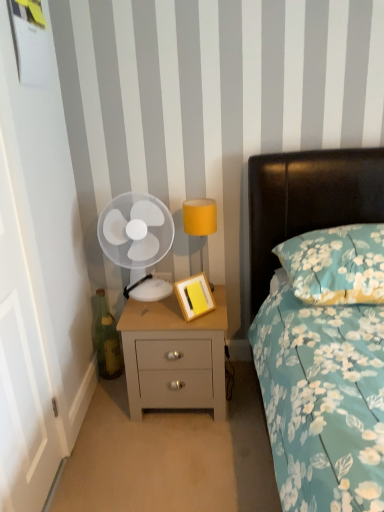
Question: Considering the relative sizes of wooden picture frame at center and floral fabric pillow at upper right in the image provided, is wooden picture frame at center smaller than floral fabric pillow at upper right?

Choices:
 (A) yes
 (B) no

Answer: (A)

Question: Is wooden picture frame at center with floral fabric pillow at upper right?

Choices:
 (A) no
 (B) yes

Answer: (A)

Question: Is wooden picture frame at center oriented away from floral fabric pillow at upper right?

Choices:
 (A) yes
 (B) no

Answer: (B)

Question: Is wooden picture frame at center at the left side of floral fabric pillow at upper right?

Choices:
 (A) no
 (B) yes

Answer: (B)

Question: From the image's perspective, is wooden picture frame at center on top of floral fabric pillow at upper right?

Choices:
 (A) yes
 (B) no

Answer: (B)

Question: Can you confirm if wooden picture frame at center is wider than floral fabric pillow at upper right?

Choices:
 (A) no
 (B) yes

Answer: (A)

Question: Does light gray wood nightstand at center have a larger size compared to floral fabric pillow at upper right?

Choices:
 (A) yes
 (B) no

Answer: (A)

Question: Does light gray wood nightstand at center have a lesser height compared to floral fabric pillow at upper right?

Choices:
 (A) yes
 (B) no

Answer: (B)

Question: From the image's perspective, does light gray wood nightstand at center appear lower than floral fabric pillow at upper right?

Choices:
 (A) yes
 (B) no

Answer: (A)

Question: Is light gray wood nightstand at center behind floral fabric pillow at upper right?

Choices:
 (A) yes
 (B) no

Answer: (A)

Question: Are light gray wood nightstand at center and floral fabric pillow at upper right far apart?

Choices:
 (A) yes
 (B) no

Answer: (B)

Question: Is light gray wood nightstand at center turned away from floral fabric pillow at upper right?

Choices:
 (A) no
 (B) yes

Answer: (A)

Question: Is white plastic fan at left at the back of floral fabric pillow at upper right?

Choices:
 (A) yes
 (B) no

Answer: (B)